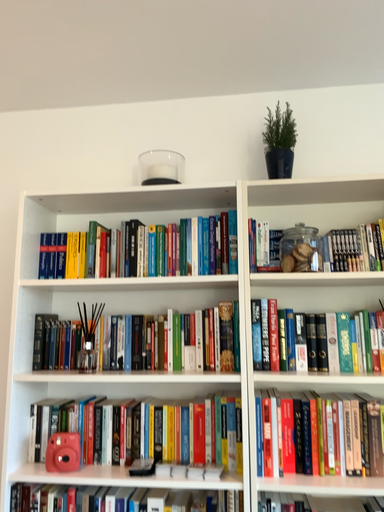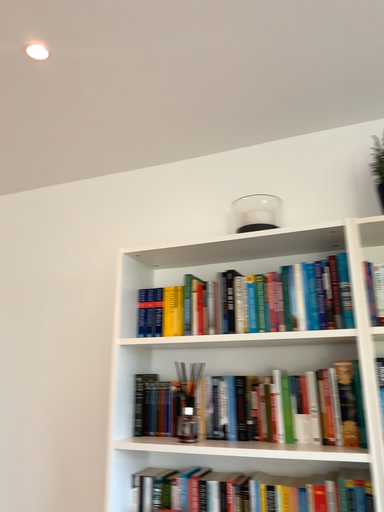
Question: How did the camera likely rotate when shooting the video?

Choices:
 (A) rotated right
 (B) rotated left

Answer: (B)